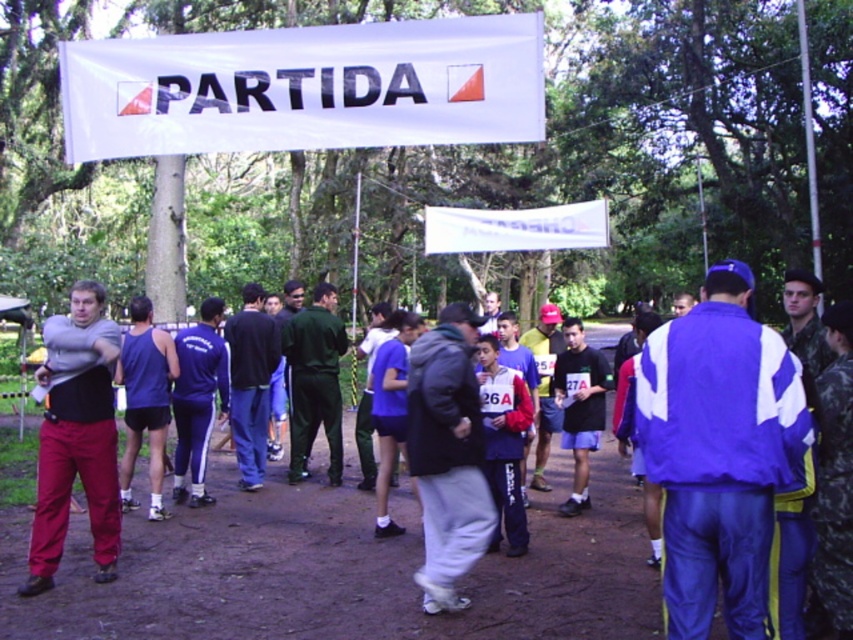
You are at the starting line of the race and need to move from the first checkpoint to the second checkpoint. The first checkpoint is located at point (463, 141) and the second is at point (85, 449). Which direction should you move to reach the second checkpoint from the first?

To move from point (463, 141) to point (85, 449), you should move downward and to the right since the second point has a higher x coordinate and lower y coordinate than the first point.

You are a photographer standing at the starting line of the race. You want to take a photo that includes both point (368, 36) and point (328, 442). Which point will appear larger in your photo?

Point (368, 36) will appear larger in the photo because it is closer to the camera than point (328, 442).